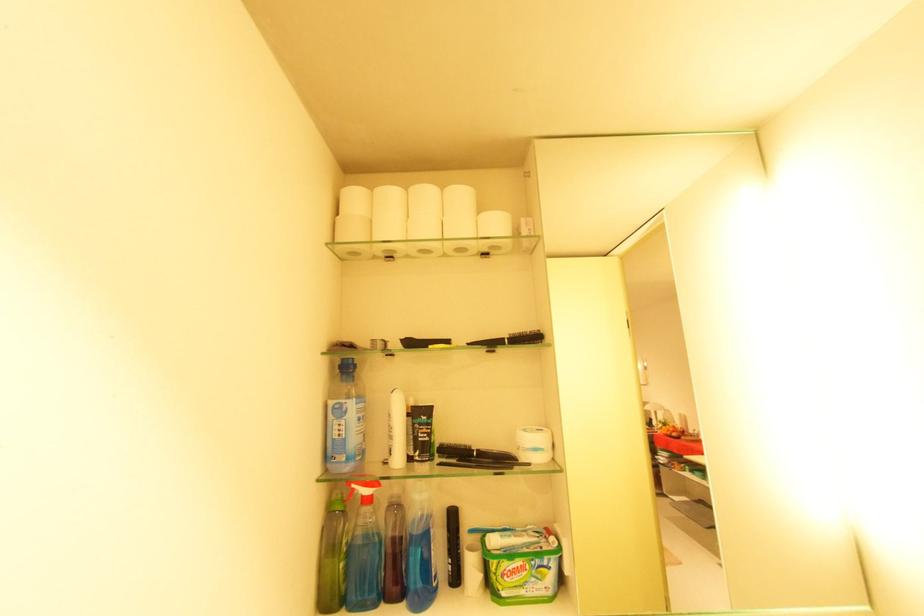
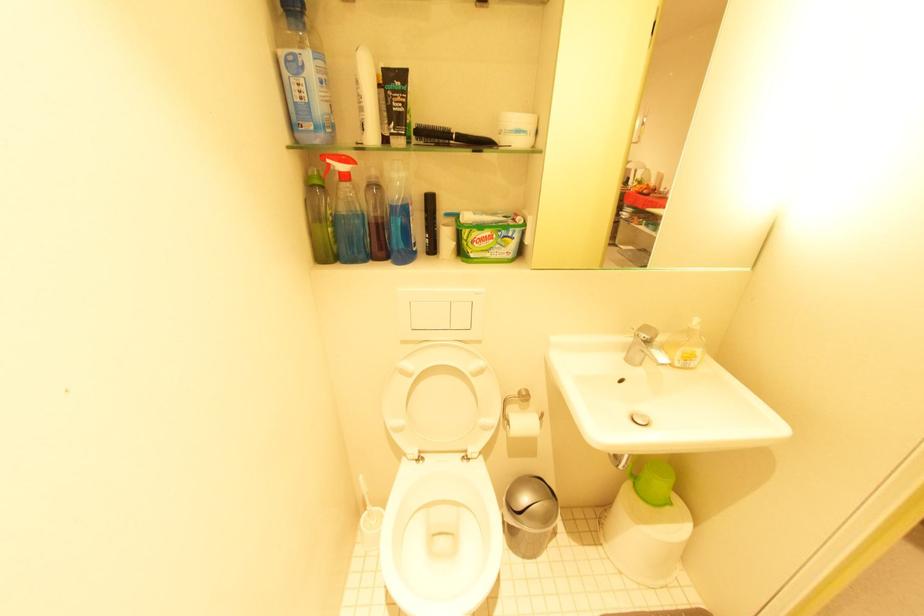
Question: The images are taken continuously from a first-person perspective. In which direction is your viewpoint rotating?

Choices:
 (A) Left
 (B) Right
 (C) Up
 (D) Down

Answer: (D)